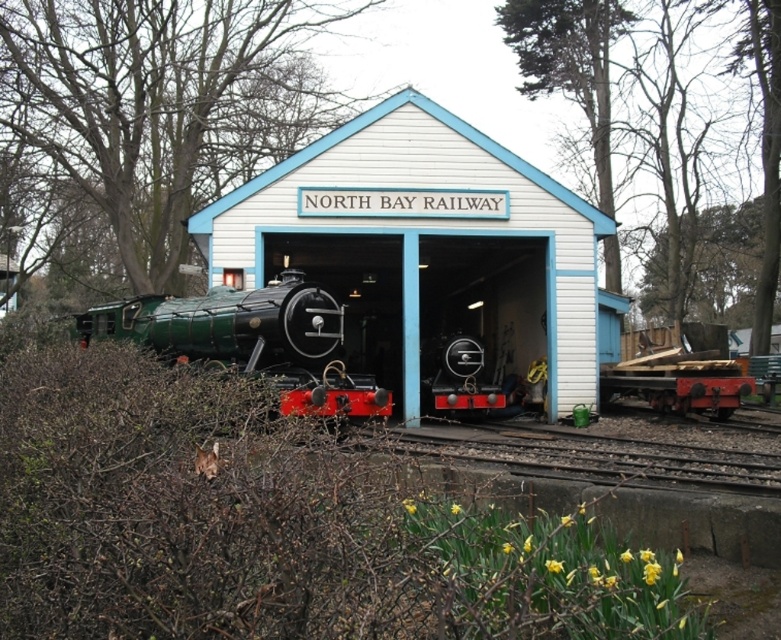
Based on the photo, you are a railway engineer who needs to determine if the white wooden railway station at center can accommodate the green polished wood train at center for maintenance. Based on their widths, will the train fit inside the station?

The white wooden railway station at center is wider than the green polished wood train at center, so the train will fit inside the station for maintenance.

You are standing at the origin point of the coordinate system. You want to reach the white wooden railway station at center. What are the coordinates you need to move to?

The coordinates to reach the white wooden railway station at center are at point (418,266).

You are a passenger waiting at the white wooden railway station at center and want to board the green polished wood train at center. Can you walk directly to the train from your current position?

The green polished wood train at center is behind the white wooden railway station at center, so you cannot walk directly to the train from your current position without going around the station.